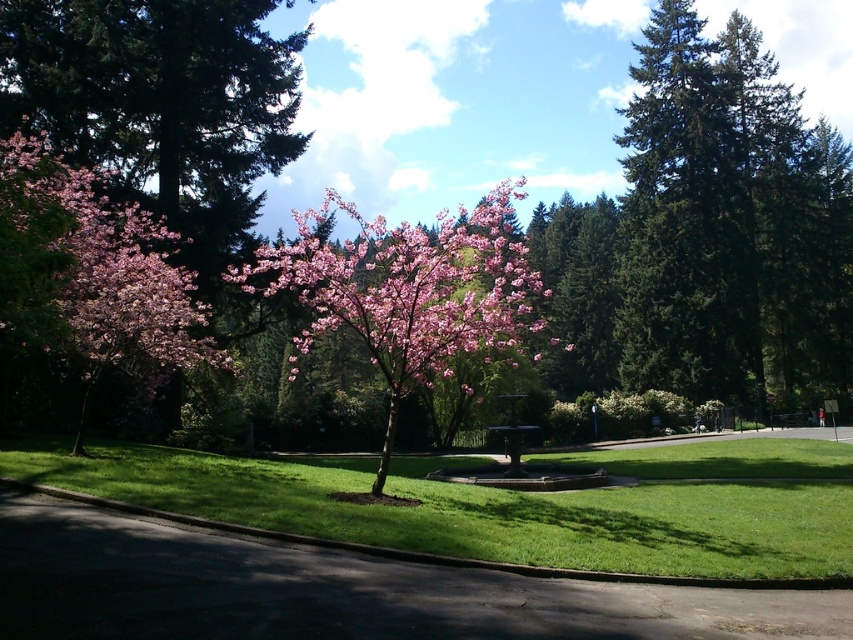
You are standing at the entrance of the park and want to walk towards both point (64, 449) and point (88, 275). Which point will you reach first?

You will reach point (64, 449) first because it is closer to you than point (88, 275), which is further away.

You are standing at the entrance of the park and want to find the pink matte flower at center. According to the coordinates given, where should you look relative to the cherry blossom tree?

The pink matte flower at center is located at coordinates point (x=408, y=285), which is in the middle ground near the cherry blossom tree.